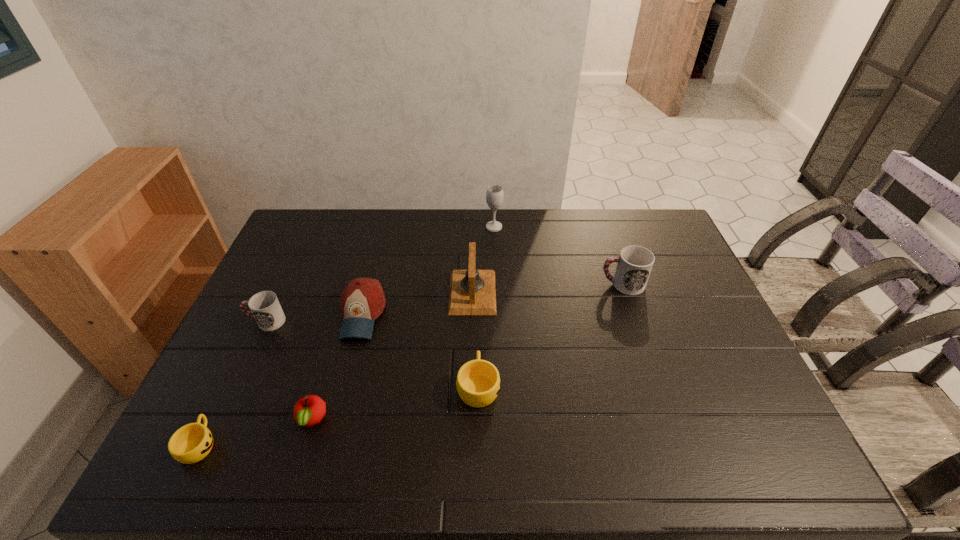
Find the location of `empty space that is in between the red apple and the nearest cup`. empty space that is in between the red apple and the nearest cup is located at coordinates (255, 432).

Image resolution: width=960 pixels, height=540 pixels. Find the location of `free space that is in between the wineglass and the bell`. free space that is in between the wineglass and the bell is located at coordinates (483, 260).

Find the location of `free area in between the apple and the rightmost cup`. free area in between the apple and the rightmost cup is located at coordinates (467, 352).

The height and width of the screenshot is (540, 960). In order to click on free space between the nearer red cup and the red baseball cap in this screenshot , I will do `click(314, 318)`.

Where is `vacant space in between the red apple and the bell`? Image resolution: width=960 pixels, height=540 pixels. vacant space in between the red apple and the bell is located at coordinates (392, 356).

Locate an element on the screen. vacant point located between the left beige cup and the third tallest cup is located at coordinates (339, 415).

Identify the location of vacant space in between the baseball cap and the nearer red cup. Image resolution: width=960 pixels, height=540 pixels. tap(314, 318).

The height and width of the screenshot is (540, 960). What are the coordinates of `object identified as the third closest to the smaller beige cup` in the screenshot? It's located at (362, 301).

This screenshot has width=960, height=540. I want to click on object that is the fourth closest one to the farther beige cup, so click(x=634, y=265).

This screenshot has height=540, width=960. I want to click on the third closest cup relative to the wineglass, so click(266, 310).